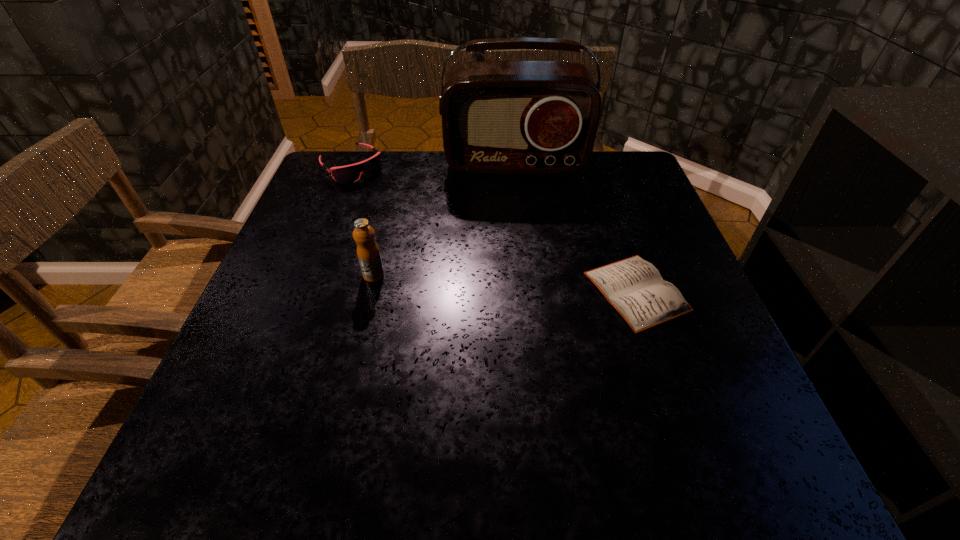
At what (x,y) coordinates should I click in order to perform the action: click on object that is at the far right corner. Please return your answer as a coordinate pair (x, y). Looking at the image, I should click on (498, 117).

Find the location of a particular element. The height and width of the screenshot is (540, 960). vacant region at the far edge of the desktop is located at coordinates (409, 186).

Find the location of a particular element. The width and height of the screenshot is (960, 540). free space at the near edge of the desktop is located at coordinates (559, 377).

This screenshot has width=960, height=540. What are the coordinates of `vacant area at the left edge` in the screenshot? It's located at (298, 238).

The width and height of the screenshot is (960, 540). In order to click on vacant area at the right edge of the desktop in this screenshot , I will do `click(684, 259)`.

In the image, there is a desktop. Where is `vacant space at the far right corner`? This screenshot has height=540, width=960. vacant space at the far right corner is located at coordinates (596, 189).

In the image, there is a desktop. At what (x,y) coordinates should I click in order to perform the action: click on vacant space at the near right corner. Please return your answer as a coordinate pair (x, y). This screenshot has width=960, height=540. Looking at the image, I should click on (666, 396).

I want to click on blank region between the tallest object and the diary, so click(x=576, y=227).

At what (x,y) coordinates should I click in order to perform the action: click on free space between the radio receiver and the leftmost object. Please return your answer as a coordinate pair (x, y). Image resolution: width=960 pixels, height=540 pixels. Looking at the image, I should click on (433, 165).

This screenshot has width=960, height=540. I want to click on free space between the tallest object and the shortest object, so (576, 227).